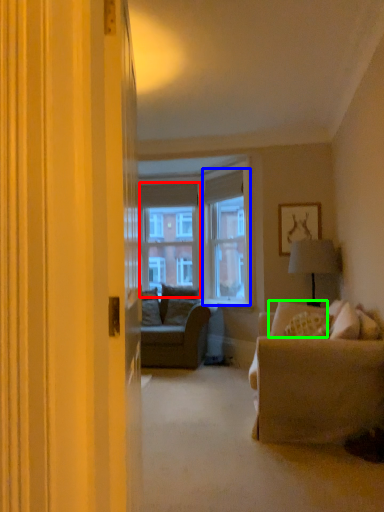
Question: Considering the real-world distances, which object is farthest from window screen (highlighted by a red box)? window screen (highlighted by a blue box) or pillow (highlighted by a green box)?

Choices:
 (A) window screen
 (B) pillow

Answer: (B)